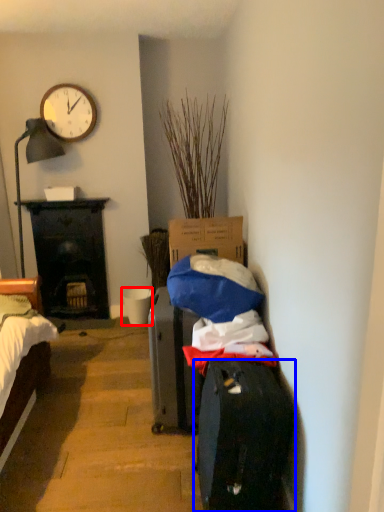
Question: Which point is closer to the camera, bucket (highlighted by a red box) or luggage and bags (highlighted by a blue box)?

Choices:
 (A) bucket
 (B) luggage and bags

Answer: (B)